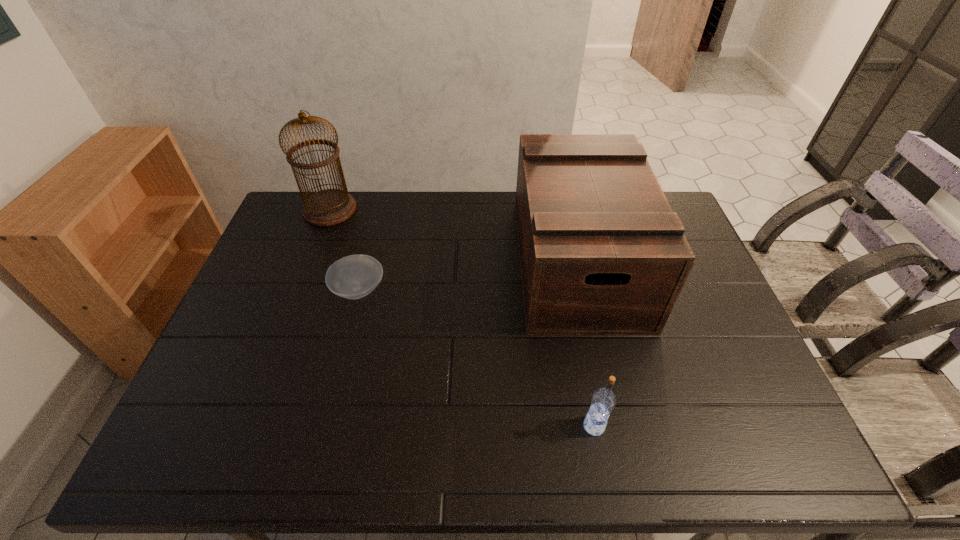
The image size is (960, 540). Find the location of `vacant space situated on the left of the third object from right to left`. vacant space situated on the left of the third object from right to left is located at coordinates (288, 290).

The image size is (960, 540). What are the coordinates of `birdcage that is positioned at the far edge` in the screenshot? It's located at (327, 207).

Identify the location of box present at the far edge. The image size is (960, 540). (601, 252).

Find the location of a particular element. This screenshot has height=540, width=960. object that is at the near edge is located at coordinates (603, 401).

You are a GUI agent. You are given a task and a screenshot of the screen. Output one action in this format:
    pyautogui.click(x=<x>, y=<y>)
    Task: Click on the object positioned at the left edge
    
    Given the screenshot: What is the action you would take?
    pyautogui.click(x=327, y=207)

You are a GUI agent. You are given a task and a screenshot of the screen. Output one action in this format:
    pyautogui.click(x=<x>, y=<y>)
    Task: Click on the object that is at the far left corner
    
    Given the screenshot: What is the action you would take?
    pyautogui.click(x=327, y=207)

In the image, there is a desktop. At what (x,y) coordinates should I click in order to perform the action: click on vacant space at the far edge. Please return your answer as a coordinate pair (x, y). The height and width of the screenshot is (540, 960). Looking at the image, I should click on (471, 234).

This screenshot has height=540, width=960. I want to click on free region at the near edge of the desktop, so click(625, 465).

I want to click on vacant area at the left edge of the desktop, so click(x=243, y=369).

In the image, there is a desktop. Where is `vacant area at the right edge`? vacant area at the right edge is located at coordinates (737, 377).